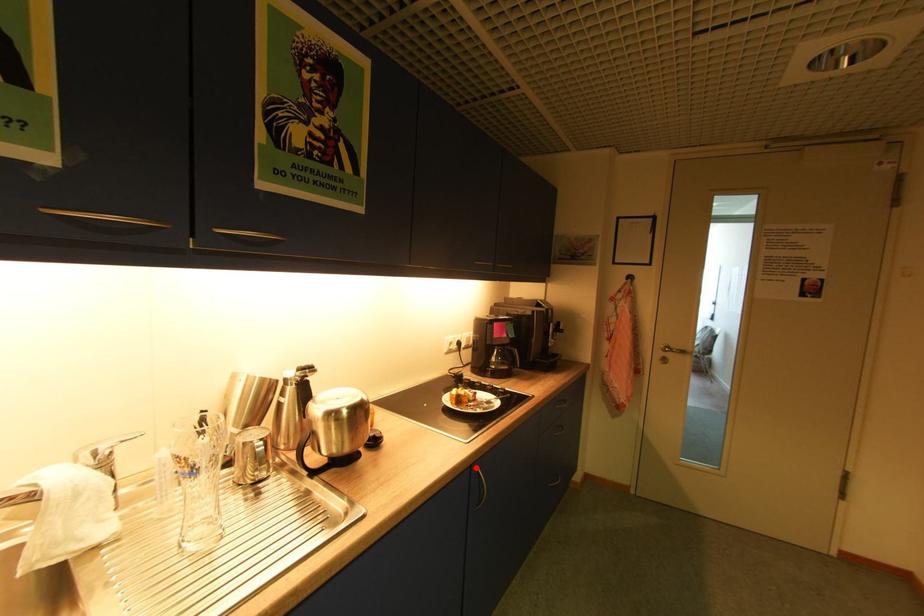
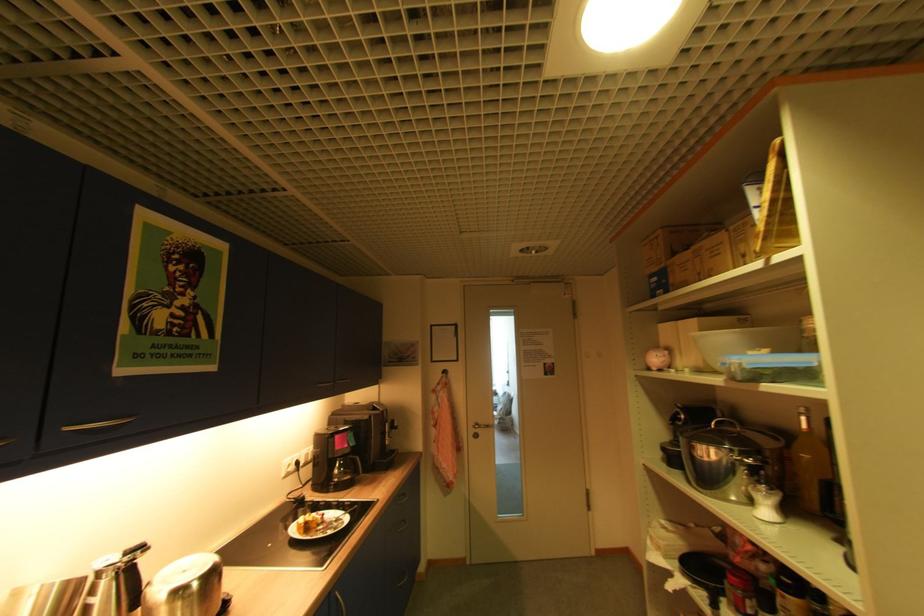
Question: I am providing you with two images of the same scene from different viewpoints. In image1, a red point is highlighted. Considering the same 3D point in image2, which of the following is correct?

Choices:
 (A) It is closer
 (B) It is farther

Answer: (A)